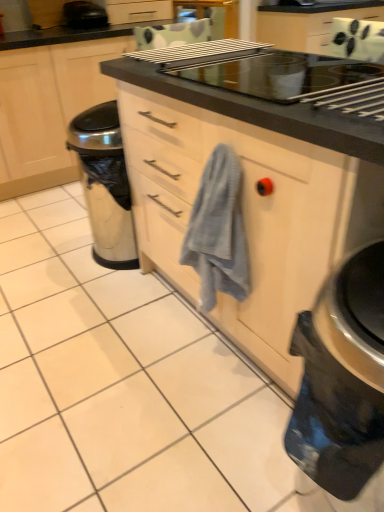
Question: In terms of height, does gray textured towel at center look taller or shorter compared to black glossy electric kettle at lower right?

Choices:
 (A) short
 (B) tall

Answer: (A)

Question: Looking at their shapes, would you say gray textured towel at center is wider or thinner than black glossy electric kettle at lower right?

Choices:
 (A) thin
 (B) wide

Answer: (A)

Question: Which is farther from the matte black cabinet at center?

Choices:
 (A) gray textured towel at center
 (B) black glossy electric kettle at lower right
 (C) black plastic toaster at upper left

Answer: (B)

Question: Which of these objects is positioned farthest from the black plastic toaster at upper left?

Choices:
 (A) gray textured towel at center
 (B) matte black cabinet at center
 (C) black glossy electric kettle at lower right

Answer: (C)